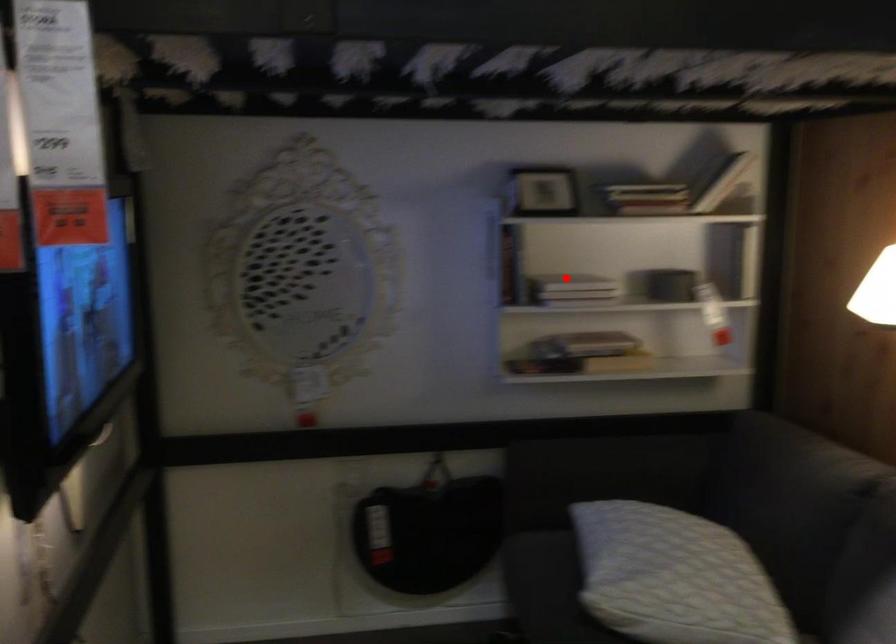
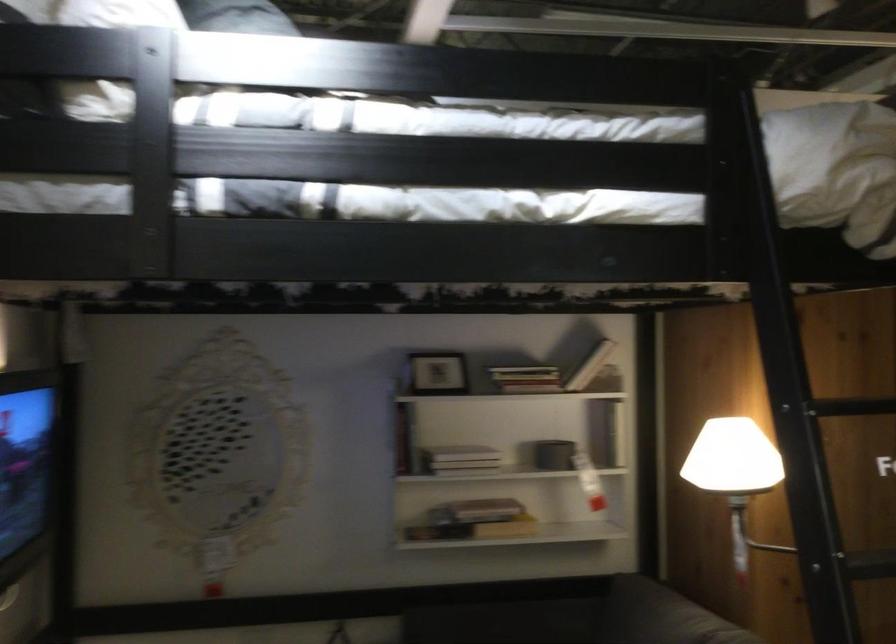
Find the pixel in the second image that matches the highlighted location in the first image.

(460, 453)